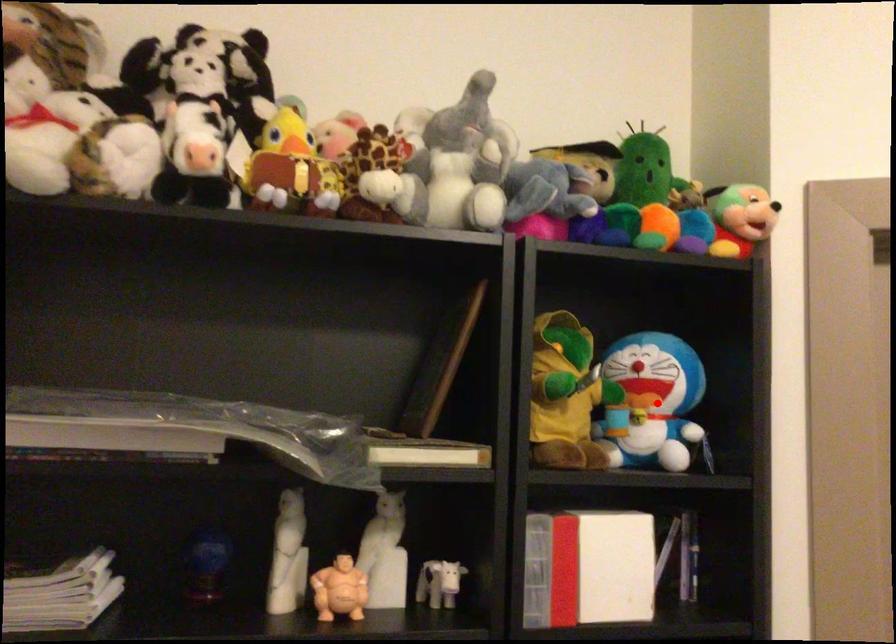
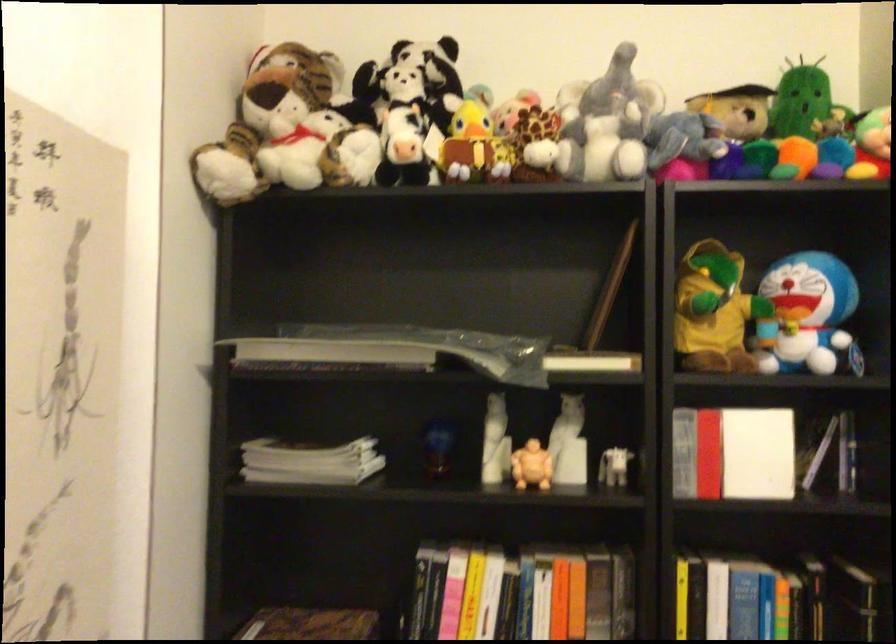
Locate, in the second image, the point that corresponds to the highlighted location in the first image.

(807, 317)